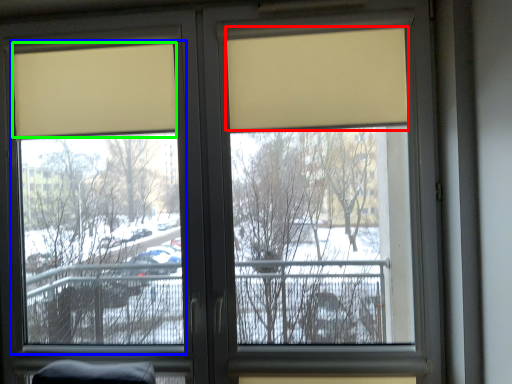
Question: Which object is positioned closest to curtain (highlighted by a red box)? Select from window screen (highlighted by a blue box) and curtain (highlighted by a green box).

Choices:
 (A) window screen
 (B) curtain

Answer: (B)